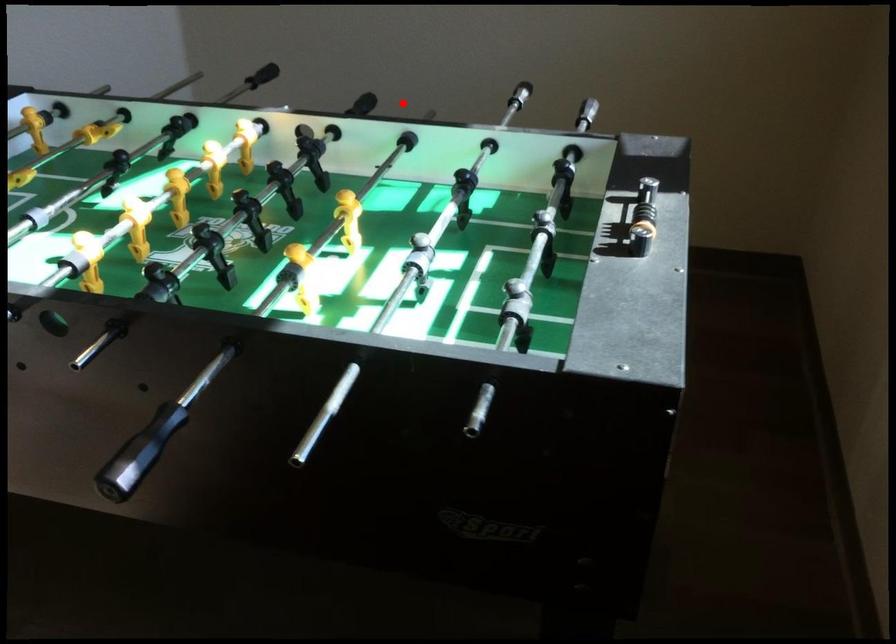
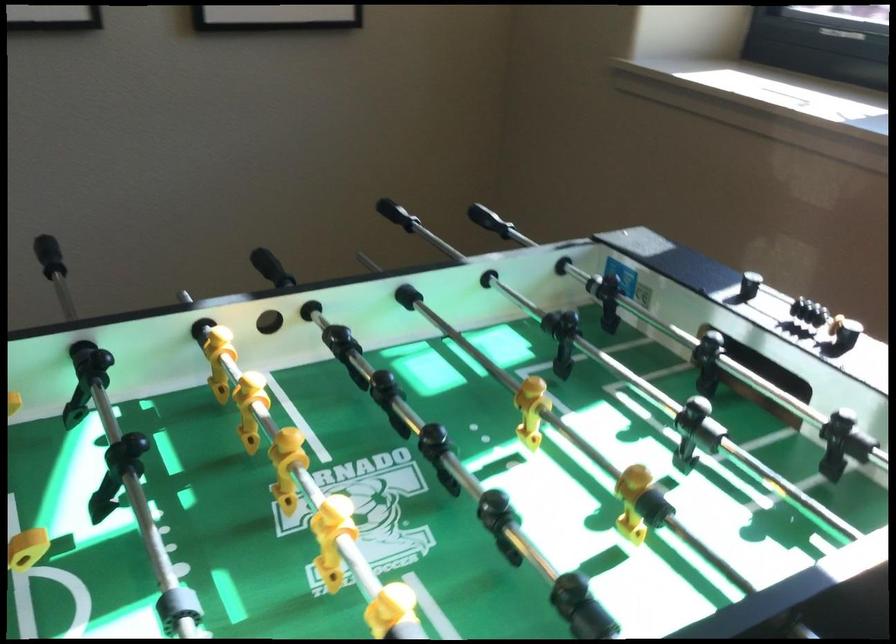
Question: I am providing you with two images of the same scene from different viewpoints. Image1 has a red point marked. In image2, the corresponding 3D location appears at what relative position? Reply with the corresponding letter.

Choices:
 (A) Closer
 (B) Farther

Answer: (A)